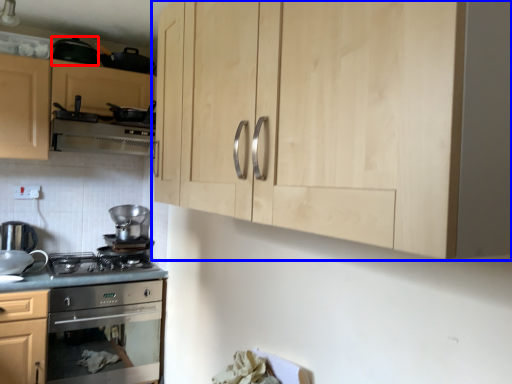
Question: Which object appears closest to the camera in this image, appliance (highlighted by a red box) or cabinetry (highlighted by a blue box)?

Choices:
 (A) appliance
 (B) cabinetry

Answer: (B)